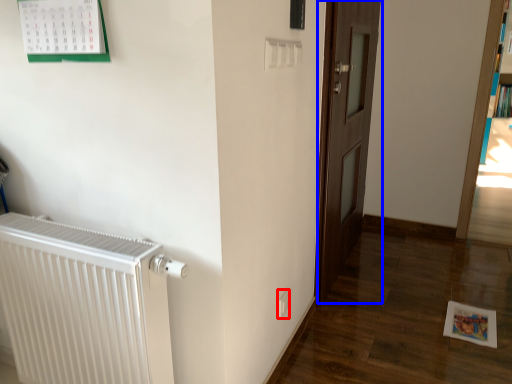
Question: Which object appears closest to the camera in this image, electric outlet (highlighted by a red box) or door (highlighted by a blue box)?

Choices:
 (A) electric outlet
 (B) door

Answer: (A)